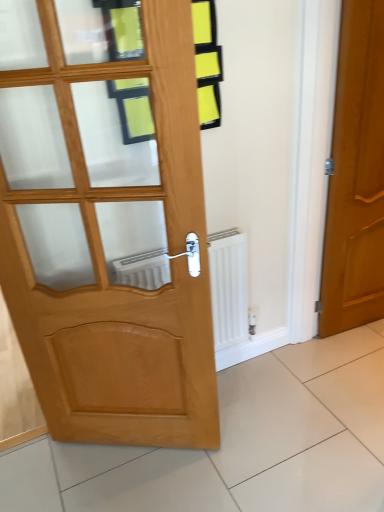
Question: Is glossy wood door at right, the 1th door from the right, spatially inside white matte radiator at center, or outside of it?

Choices:
 (A) outside
 (B) inside

Answer: (A)

Question: Is glossy wood door at right, the 1th door from the right, bigger or smaller than white matte radiator at center?

Choices:
 (A) small
 (B) big

Answer: (B)

Question: Estimate the real-world distances between objects in this image. Which object is farther from the white matte radiator at center?

Choices:
 (A) light brown wooden door at left, which is counted as the 2th door, starting from the right
 (B) glossy wood door at right, the 1th door from the right

Answer: (B)

Question: Estimate the real-world distances between objects in this image. Which object is farther from the glossy wood door at right, the 1th door from the right?

Choices:
 (A) light brown wooden door at left, which is counted as the 2th door, starting from the right
 (B) white matte radiator at center

Answer: (A)